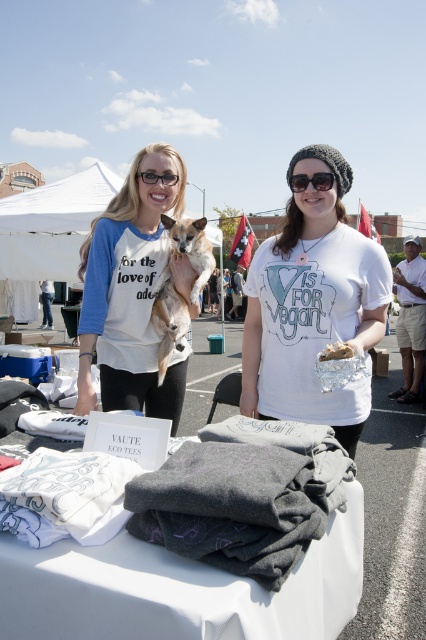
You are at an outdoor event and see the white fur dog at center and the clear plastic glasses at upper center. Which object is positioned to the right of the other?

The white fur dog at center is to the right of the clear plastic glasses at upper center.

You are a photographer at the event and need to place a small camera bag between the white fabric shirts at lower center and the black knit beanie at upper center. Which object should you place the bag closer to if you want it to be near the larger item?

The white fabric shirts at lower center is bigger than the black knit beanie at upper center, so you should place the camera bag closer to the white fabric shirts at lower center to be near the larger item.